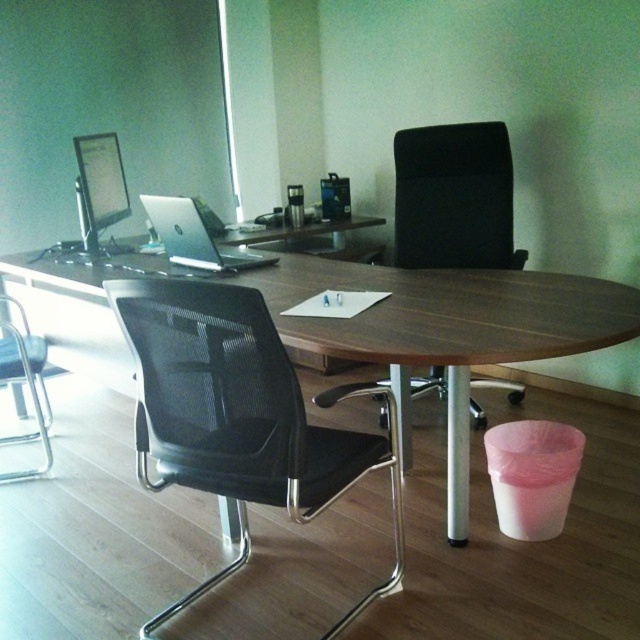
Does black mesh swivel chair at center have a lesser height compared to silver metallic laptop at center?

No, black mesh swivel chair at center is not shorter than silver metallic laptop at center.

Is the position of black mesh swivel chair at center more distant than that of silver metallic laptop at center?

No, black mesh swivel chair at center is in front of silver metallic laptop at center.

Is point (300, 506) farther from camera compared to point (196, 241)?

No, it is in front of (196, 241).

Identify the location of black mesh swivel chair at center. (237, 413).

Is wooden desk at center to the left of black mesh chair at left from the viewer's perspective?

In fact, wooden desk at center is to the right of black mesh chair at left.

Between point (561, 292) and point (29, 372), which one is positioned in front?

Point (561, 292)

Image resolution: width=640 pixels, height=640 pixels. Identify the location of wooden desk at center. (448, 332).

In the scene shown: Between black mesh chair at center and silver metallic laptop at center, which one has more height?

black mesh chair at center is taller.

Does black mesh chair at center have a greater height compared to silver metallic laptop at center?

Yes, black mesh chair at center is taller than silver metallic laptop at center.

This screenshot has height=640, width=640. I want to click on black mesh chair at center, so click(x=454, y=196).

What are the coordinates of `black mesh chair at center` in the screenshot? It's located at (454, 196).